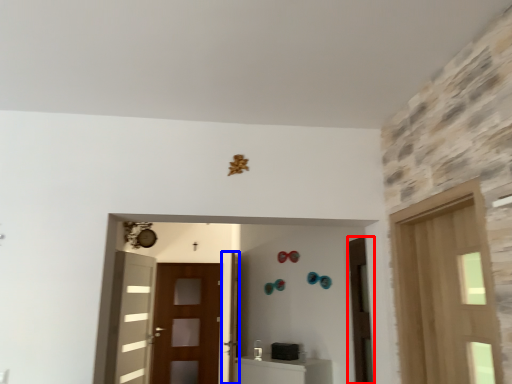
Question: Which point is further to the camera, door (highlighted by a red box) or door (highlighted by a blue box)?

Choices:
 (A) door
 (B) door

Answer: (B)